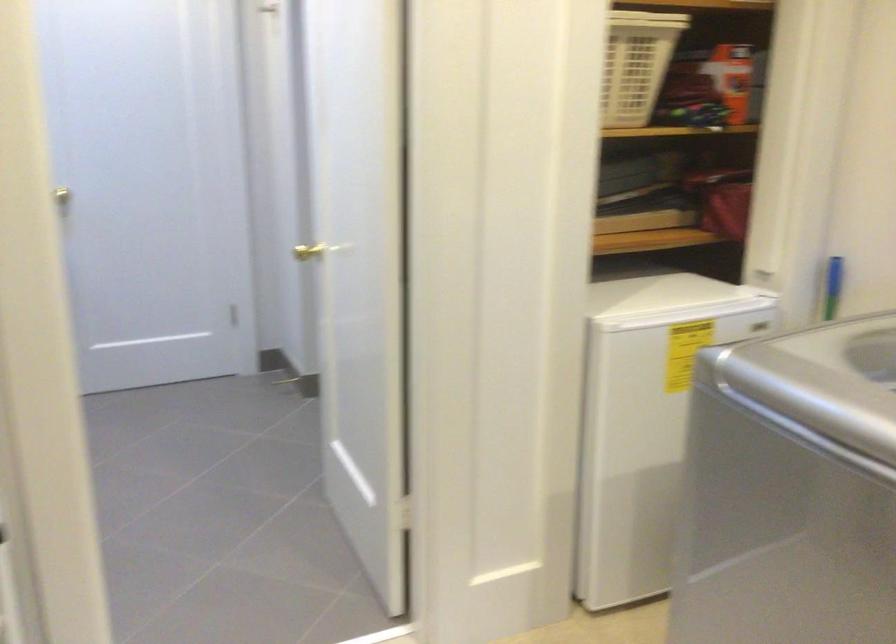
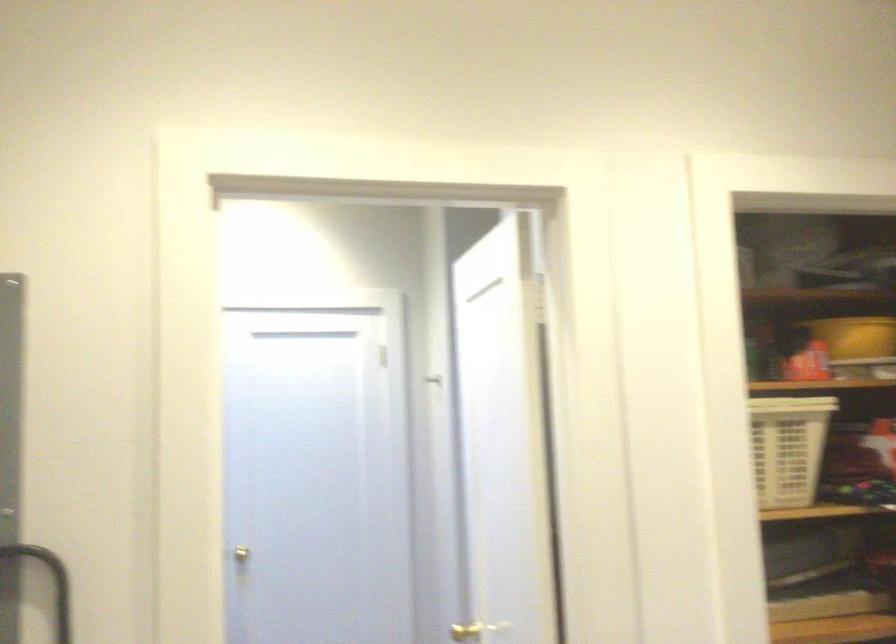
Question: The first image is from the beginning of the video and the second image is from the end. How did the camera likely rotate when shooting the video?

Choices:
 (A) Left
 (B) Right
 (C) Up
 (D) Down

Answer: (C)